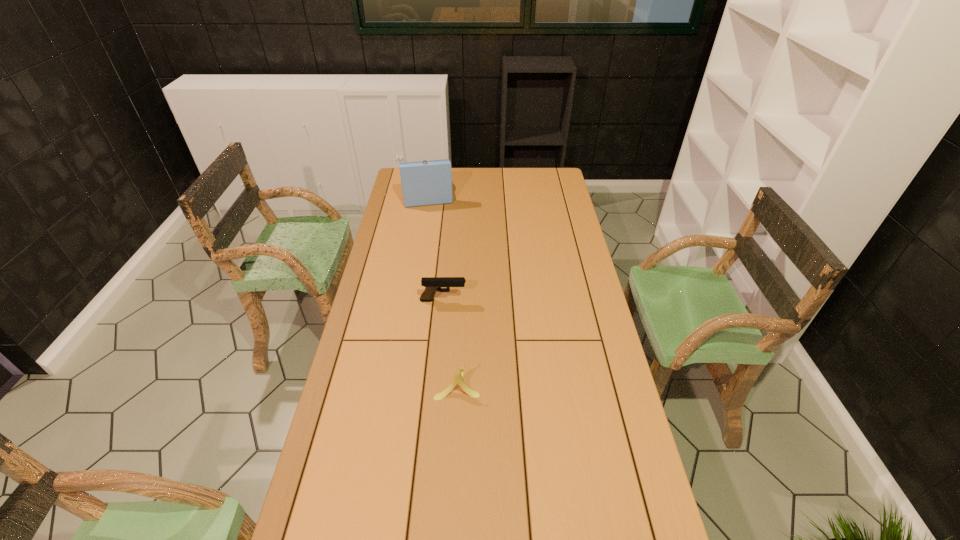
At what (x,y) coordinates should I click in order to perform the action: click on vacant region at the far edge of the desktop. Please return your answer as a coordinate pair (x, y). This screenshot has height=540, width=960. Looking at the image, I should click on (478, 173).

You are a GUI agent. You are given a task and a screenshot of the screen. Output one action in this format:
    pyautogui.click(x=<x>, y=<y>)
    Task: Click on the free point at the left edge
    The height and width of the screenshot is (540, 960).
    Given the screenshot: What is the action you would take?
    pyautogui.click(x=373, y=284)

I want to click on blank space at the right edge of the desktop, so click(x=575, y=224).

At what (x,y) coordinates should I click in order to perform the action: click on vacant space at the far right corner of the desktop. Please return your answer as a coordinate pair (x, y). The image size is (960, 540). Looking at the image, I should click on (542, 179).

At what (x,y) coordinates should I click in order to perform the action: click on vacant area between the tallest object and the pistol. Please return your answer as a coordinate pair (x, y). The image size is (960, 540). Looking at the image, I should click on (435, 246).

You are a GUI agent. You are given a task and a screenshot of the screen. Output one action in this format:
    pyautogui.click(x=<x>, y=<y>)
    Task: Click on the free area in between the tallest object and the second farthest object
    
    Given the screenshot: What is the action you would take?
    pyautogui.click(x=435, y=246)

Find the location of a particular element. The width and height of the screenshot is (960, 540). vacant area between the farthest object and the pistol is located at coordinates (435, 246).

Point out which object is positioned as the second nearest to the phonograph record. Please provide its 2D coordinates. Your answer should be formatted as a tuple, i.e. [(x, y)], where the tuple contains the x and y coordinates of a point satisfying the conditions above.

[(458, 376)]

The width and height of the screenshot is (960, 540). I want to click on object identified as the closest to the banana, so click(432, 284).

Locate an element on the screen. This screenshot has height=540, width=960. free location that satisfies the following two spatial constraints: 1. on the back side of the nearest object; 2. on the front-facing side of the pistol is located at coordinates (461, 300).